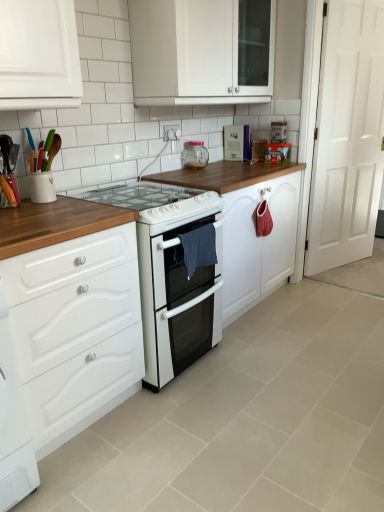
The image size is (384, 512). In order to click on vacant area that lies in front of white wooden door at right in this screenshot , I will do coord(347,279).